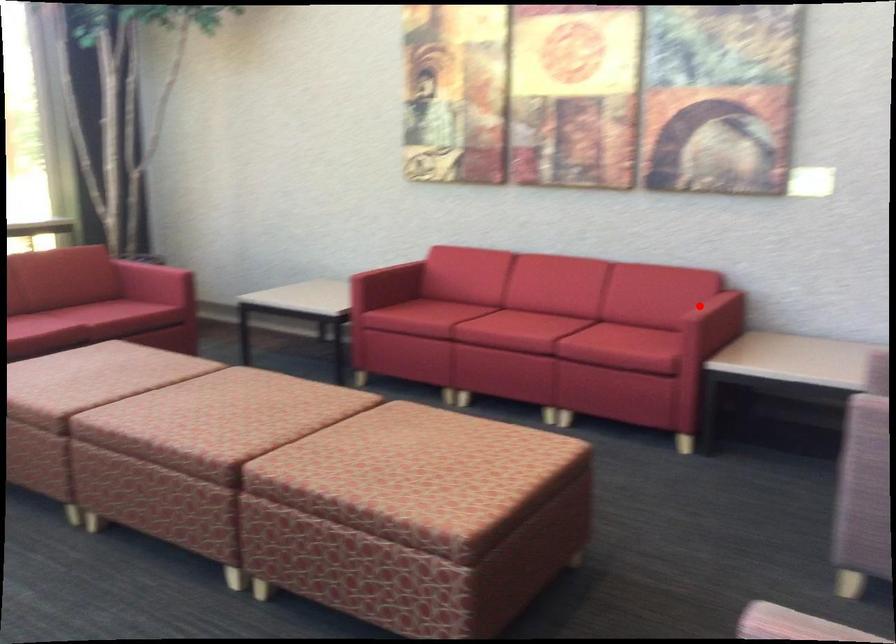
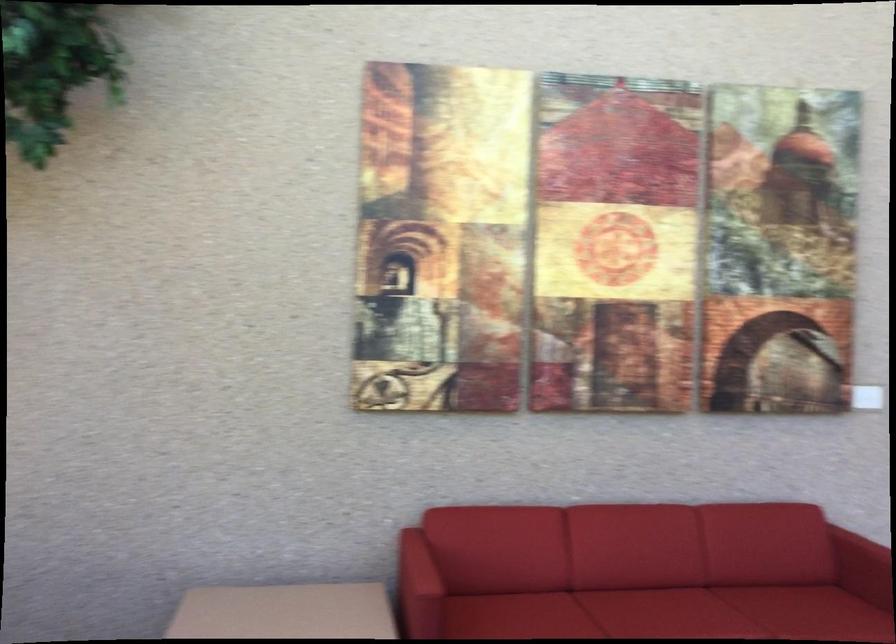
Question: I am providing you with two images of the same scene from different viewpoints. In image1, a red point is highlighted. Considering the same 3D point in image2, which of the following is correct?

Choices:
 (A) It is closer
 (B) It is farther

Answer: (A)